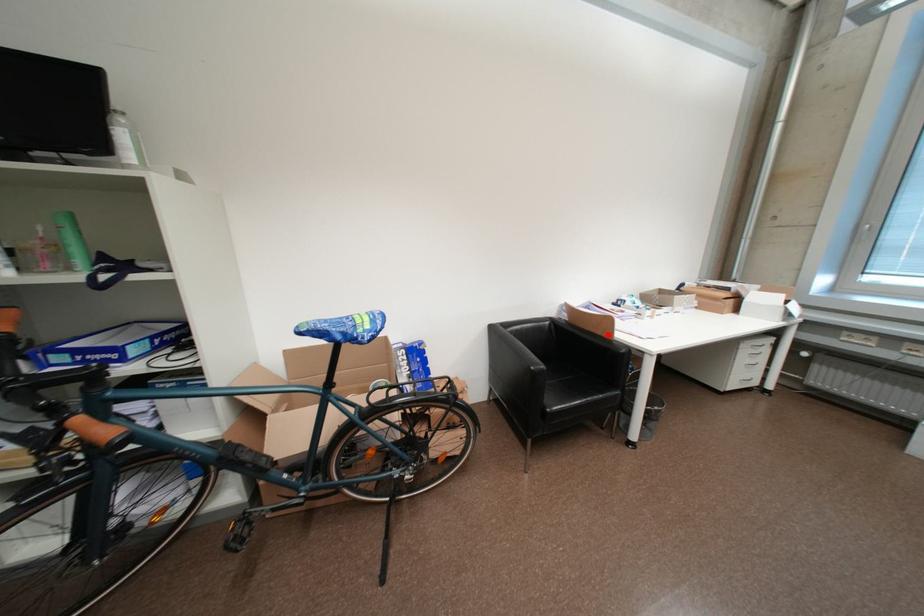
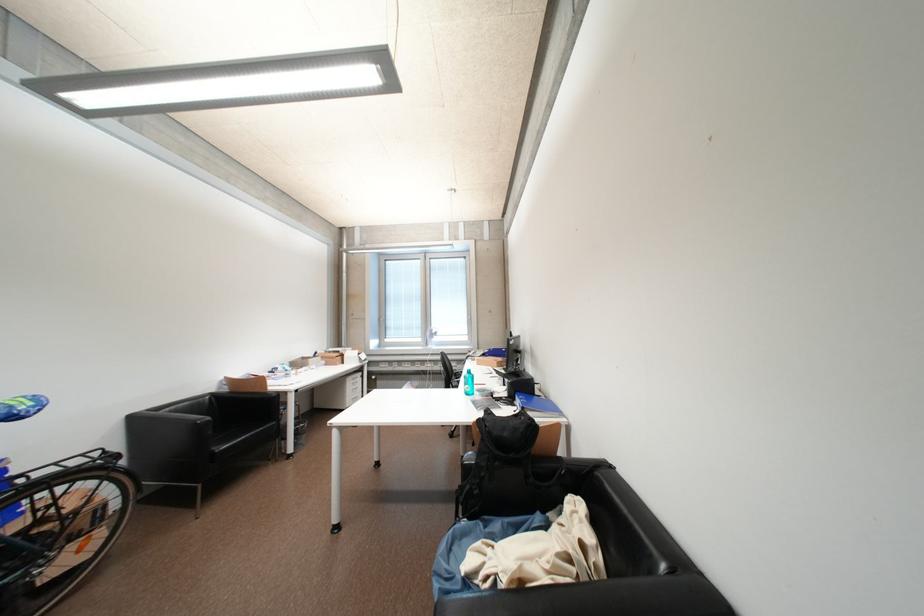
Find the pixel in the second image that matches the highlighted location in the first image.

(264, 392)